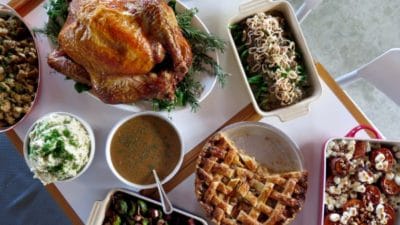
Image resolution: width=400 pixels, height=225 pixels. What are the coordinates of `placemat` in the screenshot? It's located at (220, 112).